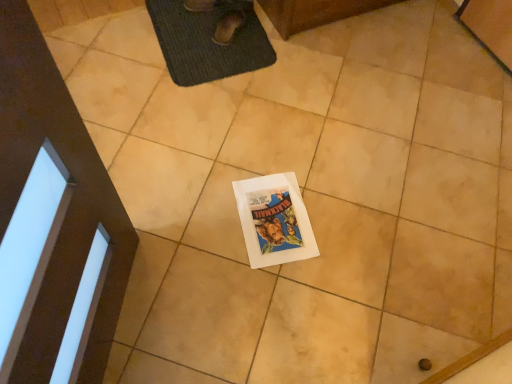
This screenshot has width=512, height=384. Identify the location of free spot to the right of dark gray textured bath mat at upper center. (315, 68).